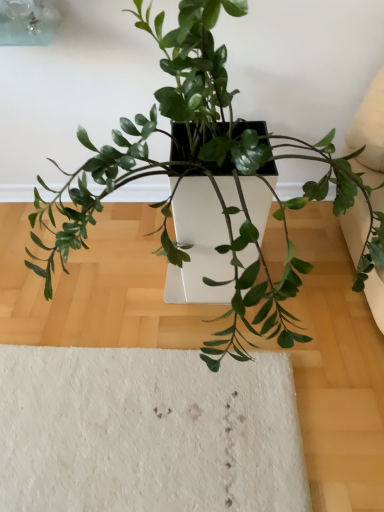
Identify the location of vacant space in green glossy plant at center (from a real-world perspective). The width and height of the screenshot is (384, 512). (181, 310).